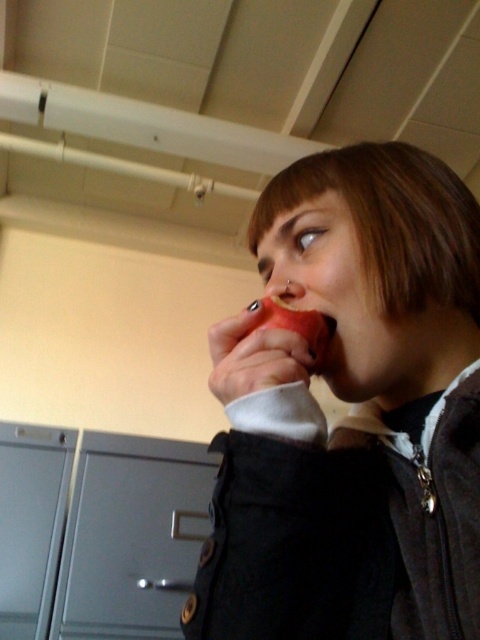
Question: Does red matte apple at mouth have a greater width compared to matte flesh-colored nose at center?

Choices:
 (A) no
 (B) yes

Answer: (B)

Question: Does matte red apple at center appear on the right side of gray matte/file cabinet at lower left?

Choices:
 (A) yes
 (B) no

Answer: (A)

Question: Can you confirm if gray matte/file cabinet at lower left is wider than matte flesh-colored nose at center?

Choices:
 (A) no
 (B) yes

Answer: (B)

Question: Estimate the real-world distances between objects in this image. Which object is closer to the matte flesh-colored nose at center?

Choices:
 (A) gray matte/file cabinet at lower left
 (B) matte red apple at center
 (C) red matte apple at mouth

Answer: (C)

Question: Based on their relative distances, which object is farther from the matte flesh-colored nose at center?

Choices:
 (A) matte red apple at center
 (B) gray matte/file cabinet at lower left

Answer: (B)

Question: Which object is positioned farthest from the red matte apple at mouth?

Choices:
 (A) matte flesh-colored nose at center
 (B) matte red apple at center
 (C) gray matte/file cabinet at lower left

Answer: (C)